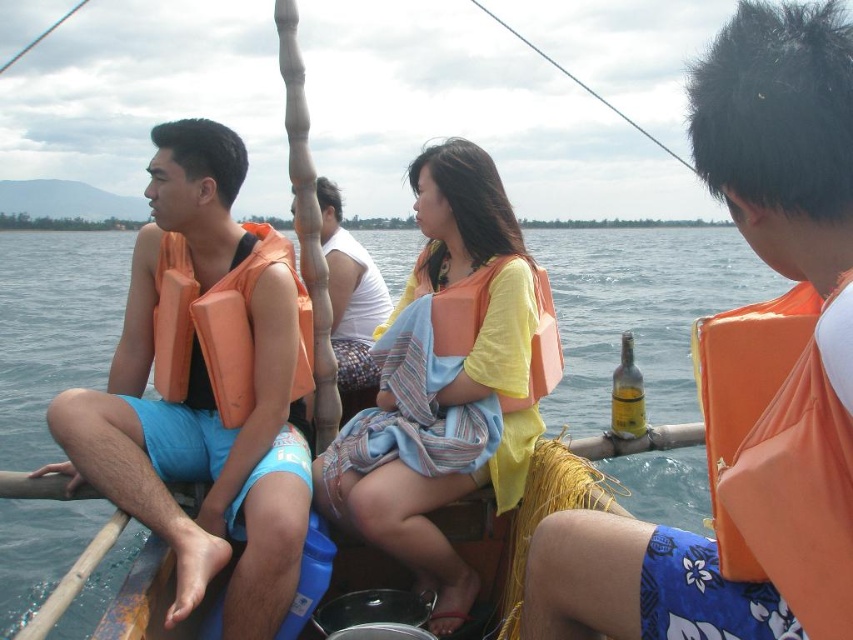
Question: Does orange life vest at right have a greater width compared to orange fabric life jacket at center?

Choices:
 (A) no
 (B) yes

Answer: (B)

Question: Does orange foam life jacket at right appear over orange fabric life jacket at center?

Choices:
 (A) yes
 (B) no

Answer: (B)

Question: Considering the real-world distances, which object is farthest from the orange foam life jacket at left?

Choices:
 (A) orange foam life jacket at right
 (B) orange fabric life jacket at center

Answer: (A)

Question: Which point is closer to the camera?

Choices:
 (A) transparent blue water at center
 (B) matte orange life vest at center

Answer: (B)

Question: Which object is positioned closest to the matte orange life vest at left?

Choices:
 (A) orange life vest at center
 (B) matte orange life vest at center
 (C) orange life vest at right

Answer: (A)

Question: Can you confirm if orange foam life jacket at right is smaller than orange fabric life jacket at center?

Choices:
 (A) yes
 (B) no

Answer: (B)